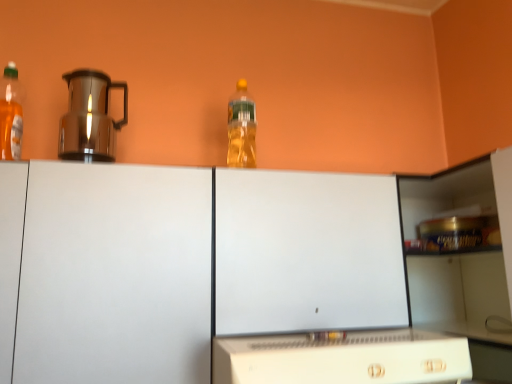
Question: Is translucent plastic bottle at upper center, the second bottle when ordered from front to back, facing away from white matte cabinet at center?

Choices:
 (A) yes
 (B) no

Answer: (B)

Question: Can you confirm if translucent plastic bottle at upper center, placed as the 1th bottle when sorted from right to left, is thinner than white matte cabinet at center?

Choices:
 (A) no
 (B) yes

Answer: (B)

Question: Does translucent plastic bottle at upper center, placed as the second bottle when sorted from left to right, appear on the right side of white matte cabinet at center?

Choices:
 (A) no
 (B) yes

Answer: (B)

Question: Is translucent plastic bottle at upper center, placed as the 1th bottle when sorted from right to left, outside white matte cabinet at center?

Choices:
 (A) no
 (B) yes

Answer: (B)

Question: Is white matte cabinet at center a part of translucent plastic bottle at upper center, placed as the second bottle when sorted from left to right?

Choices:
 (A) yes
 (B) no

Answer: (B)

Question: Can you confirm if translucent plastic bottle at upper center, the second bottle when ordered from front to back, is taller than white matte cabinet at center?

Choices:
 (A) no
 (B) yes

Answer: (A)

Question: Can we say translucent plastic bottle at upper center, the first bottle viewed from the back, lies outside translucent plastic bottle at left, arranged as the 2th bottle when viewed from the right?

Choices:
 (A) yes
 (B) no

Answer: (A)

Question: Is translucent plastic bottle at left, marked as the second bottle in a back-to-front arrangement, located within translucent plastic bottle at upper center, the second bottle when ordered from front to back?

Choices:
 (A) no
 (B) yes

Answer: (A)

Question: Is translucent plastic bottle at upper center, placed as the 1th bottle when sorted from right to left, smaller than translucent plastic bottle at left, arranged as the 2th bottle when viewed from the right?

Choices:
 (A) yes
 (B) no

Answer: (A)

Question: Are translucent plastic bottle at upper center, the second bottle when ordered from front to back, and translucent plastic bottle at left, arranged as the 2th bottle when viewed from the right, far apart?

Choices:
 (A) no
 (B) yes

Answer: (A)

Question: Is translucent plastic bottle at upper center, placed as the second bottle when sorted from left to right, positioned behind translucent plastic bottle at left, arranged as the 2th bottle when viewed from the right?

Choices:
 (A) yes
 (B) no

Answer: (A)

Question: From a real-world perspective, is translucent plastic bottle at upper center, the second bottle when ordered from front to back, positioned under translucent plastic bottle at left, arranged as the 2th bottle when viewed from the right, based on gravity?

Choices:
 (A) no
 (B) yes

Answer: (A)

Question: Is white plastic microwave at lower center completely or partially outside of shiny metallic coffee pot at left?

Choices:
 (A) no
 (B) yes

Answer: (B)